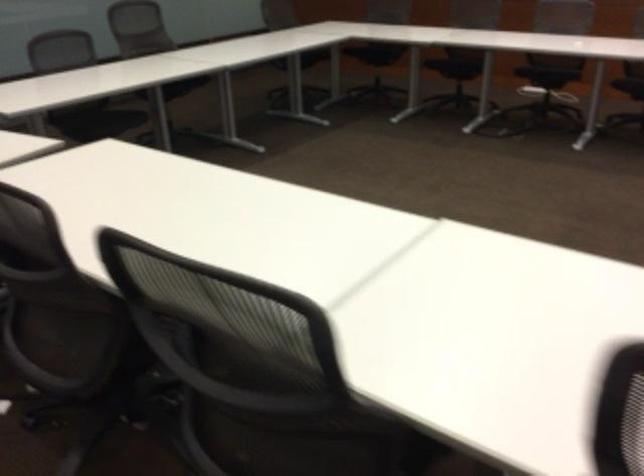
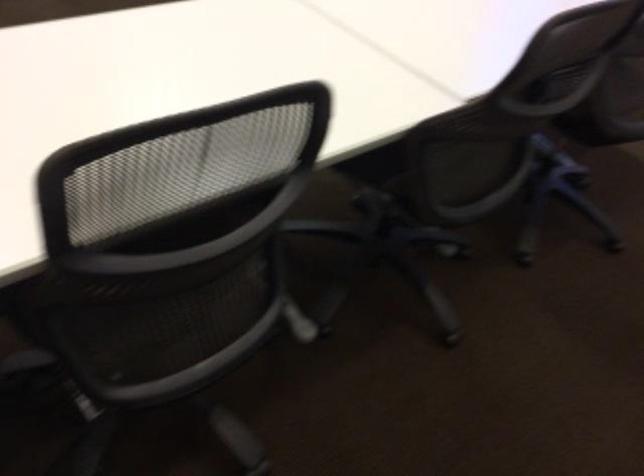
First-person continuous shooting, in which direction is the camera rotating?

The camera rotated toward right-down.